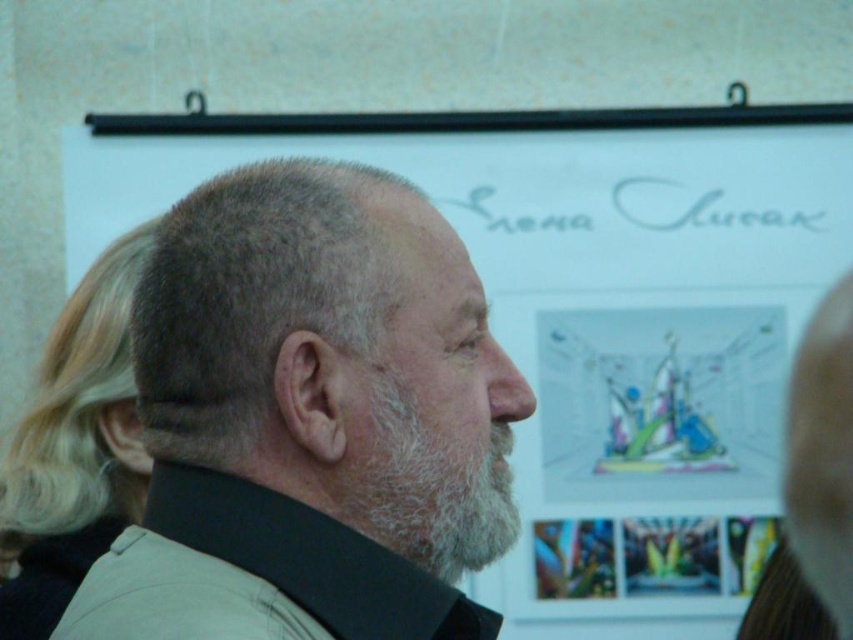
You are a photographer taking a portrait of the man. You notice the gray matte hair at center and the white fuzzy beard at center. Which of these two features is positioned closer to the camera?

The gray matte hair at center is closer to the viewer than the white fuzzy beard at center, so the hair is closer to the camera.

Based on the scene described, which object is positioned higher up, the blonde hair at left or the white fuzzy beard at center?

The blonde hair at left is positioned higher up than the white fuzzy beard at center according to the description.

You are a photographer taking a portrait of the man. You need to ensure both the gray matte hair at center and the white fuzzy beard at center are visible in the frame. Based on their positions, which side of the man should you position the light source to best highlight both features?

The gray matte hair at center is to the left of the white fuzzy beard at center. To best highlight both features, position the light source to the right side of the man. This way, the light will illuminate both the hair and the beard, creating a balanced and welllit portrait.